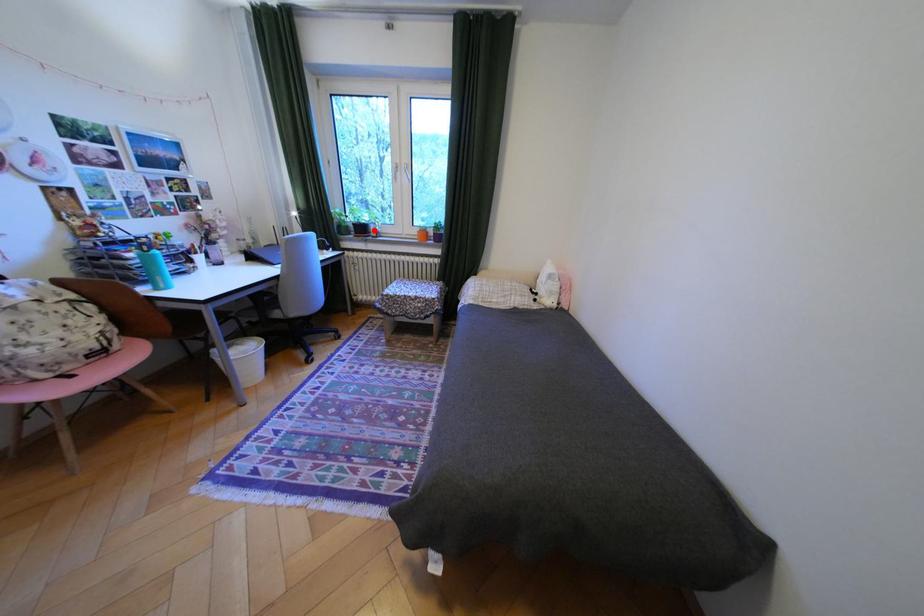
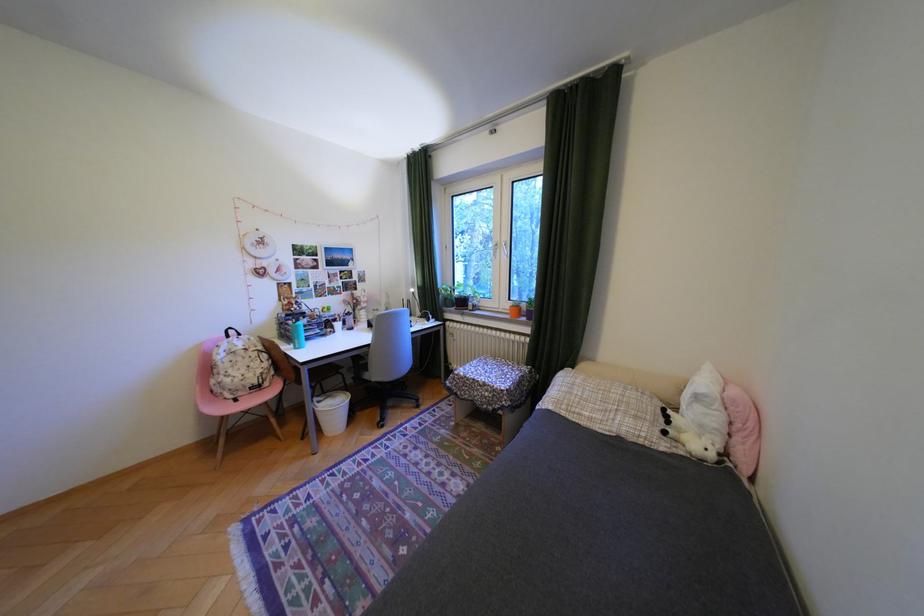
Question: I am providing you with two images of the same scene from different viewpoints. Image1 has a red point marked. In image2, the corresponding 3D location appears at what relative position? Reply with the corresponding letter.

Choices:
 (A) Closer
 (B) Farther

Answer: (B)